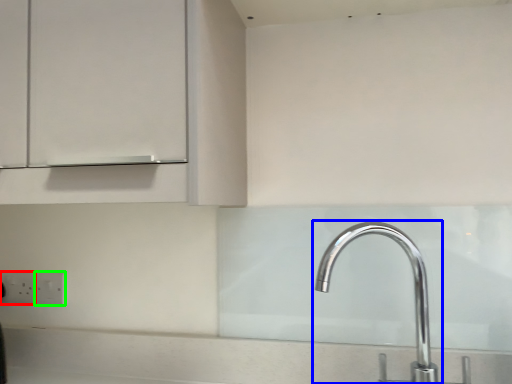
Question: Which object is positioned farthest from electric outlet (highlighted by a red box)? Select from tap (highlighted by a blue box) and electric outlet (highlighted by a green box).

Choices:
 (A) tap
 (B) electric outlet

Answer: (A)